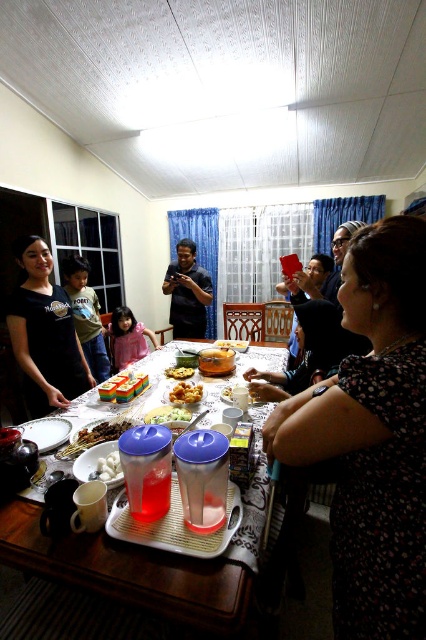
Question: Which point appears closest to the camera in this image?

Choices:
 (A) (40, 300)
 (B) (40, 435)

Answer: (B)

Question: Which of the following is the farthest from the observer?

Choices:
 (A) (195, 396)
 (B) (181, 378)
 (C) (104, 461)
 (D) (124, 380)

Answer: (B)

Question: Is clear plastic tray at center closer to camera compared to matte black shirt at center?

Choices:
 (A) no
 (B) yes

Answer: (B)

Question: Can you confirm if clear plastic tray at center is positioned to the right of rainbow cake at center?

Choices:
 (A) yes
 (B) no

Answer: (A)

Question: Does clear plastic tray at center have a larger size compared to matte black shirt at center?

Choices:
 (A) yes
 (B) no

Answer: (B)

Question: Which point is farther from the camera taking this photo?

Choices:
 (A) (36, 237)
 (B) (104, 456)

Answer: (A)